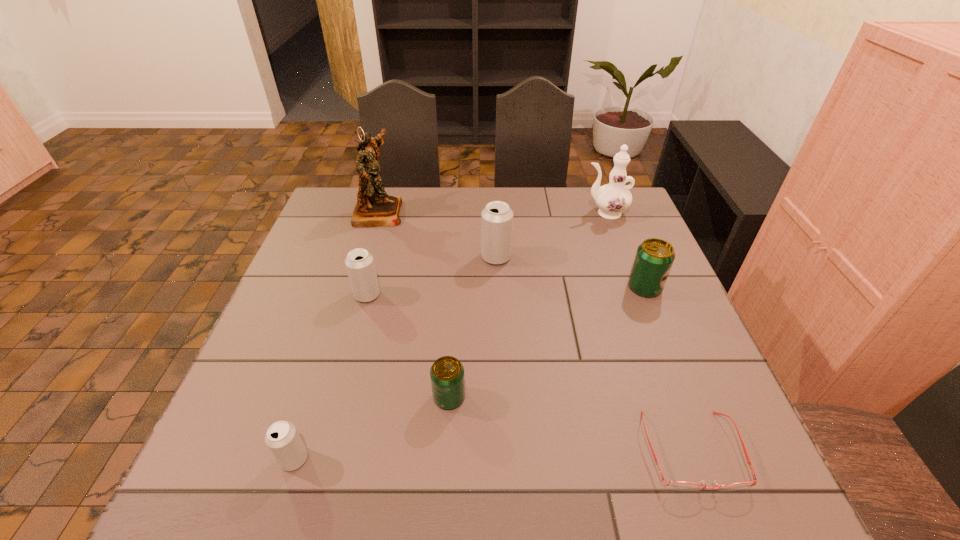
Locate an element on the screen. The height and width of the screenshot is (540, 960). object identified as the second closest to the nearer green beer can is located at coordinates (359, 263).

This screenshot has width=960, height=540. Find the location of `object that stands as the sixth closest to the rightmost white beer can`. object that stands as the sixth closest to the rightmost white beer can is located at coordinates (676, 485).

Image resolution: width=960 pixels, height=540 pixels. I want to click on beer can that is the second nearest to the sixth farthest object, so click(x=359, y=263).

Where is `beer can that stands as the fourth closest to the second biggest white beer can`? The height and width of the screenshot is (540, 960). beer can that stands as the fourth closest to the second biggest white beer can is located at coordinates (654, 258).

The width and height of the screenshot is (960, 540). I want to click on white beer can identified as the second closest to the farthest white beer can, so tap(282, 438).

Locate an element on the screen. This screenshot has height=540, width=960. white beer can object that ranks as the second closest to the farthest beer can is located at coordinates (282, 438).

Where is `free location that satisfies the following two spatial constraints: 1. at the spout of the chinaware; 2. on the front side of the rightmost white beer can`? free location that satisfies the following two spatial constraints: 1. at the spout of the chinaware; 2. on the front side of the rightmost white beer can is located at coordinates (621, 257).

I want to click on vacant area that satisfies the following two spatial constraints: 1. on the front-facing side of the gold figurine; 2. on the back side of the left green beer can, so click(323, 397).